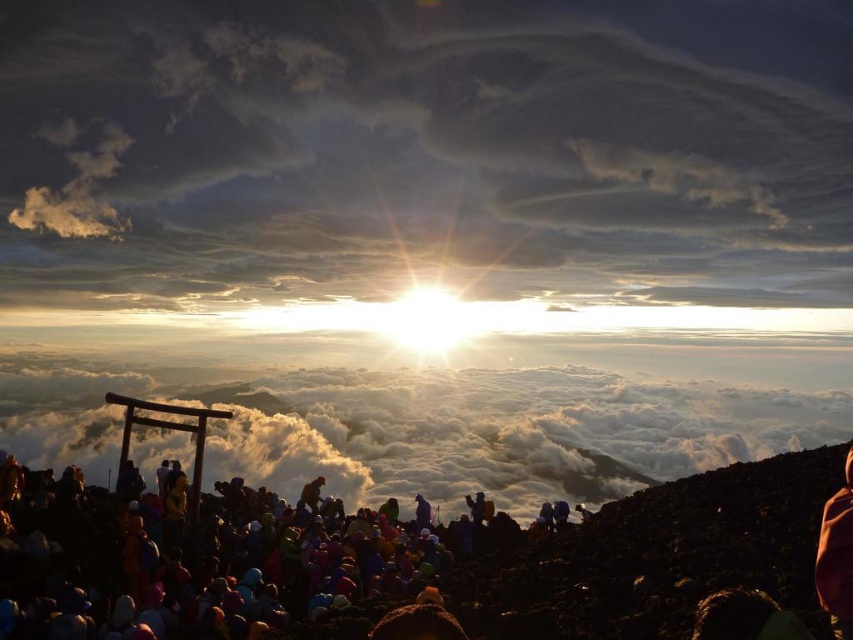
Who is shorter, white fluffy cloud at center or orange fabric person at center?

With less height is orange fabric person at center.

Looking at this image, does white fluffy cloud at center have a smaller size compared to orange fabric person at center?

No.

This screenshot has width=853, height=640. Identify the location of white fluffy cloud at center. coord(434,428).

The width and height of the screenshot is (853, 640). Find the location of `white fluffy cloud at center`. white fluffy cloud at center is located at coordinates (434, 428).

Can you confirm if cloudy sky at upper center is taller than white fluffy cloud at center?

Indeed, cloudy sky at upper center has a greater height compared to white fluffy cloud at center.

Based on the photo, does cloudy sky at upper center appear on the left side of white fluffy cloud at center?

Yes, cloudy sky at upper center is to the left of white fluffy cloud at center.

Is point (177, 125) less distant than point (541, 426)?

No, it is not.

I want to click on cloudy sky at upper center, so click(424, 150).

Which is more to the left, multicolored fabric at lower center or orange fabric person at center?

From the viewer's perspective, multicolored fabric at lower center appears more on the left side.

This screenshot has height=640, width=853. What do you see at coordinates (428, 563) in the screenshot?
I see `multicolored fabric at lower center` at bounding box center [428, 563].

Find the location of `multicolored fabric at lower center`. multicolored fabric at lower center is located at coordinates (428, 563).